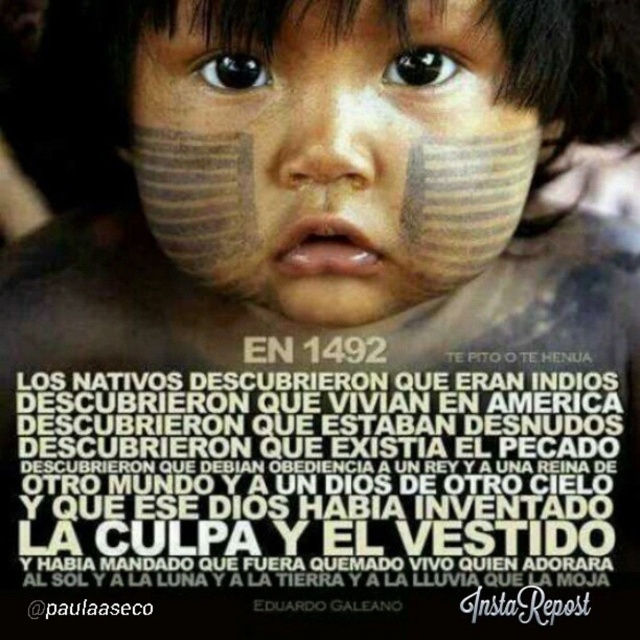
Based on the scene description, what is the relationship between the white paper text at center and the matte clay face at center?

The white paper text at center is located below the matte clay face at center.

You are a photographer standing 4 feet away from the child in the image. You want to read the text on the white paper text at center without moving closer. Can you do it easily?

The white paper text at center and viewer are 3.51 feet apart from each other. Since you are standing 4 feet away from the child, the distance to the text is within comfortable reading distance, so yes, you can read it easily without moving closer.

Based on the scene description, what is the relationship between the white paper text at center and the matte skin forehead at upper center in terms of their positions?

The white paper text at center is positioned to the left of the matte skin forehead at upper center.